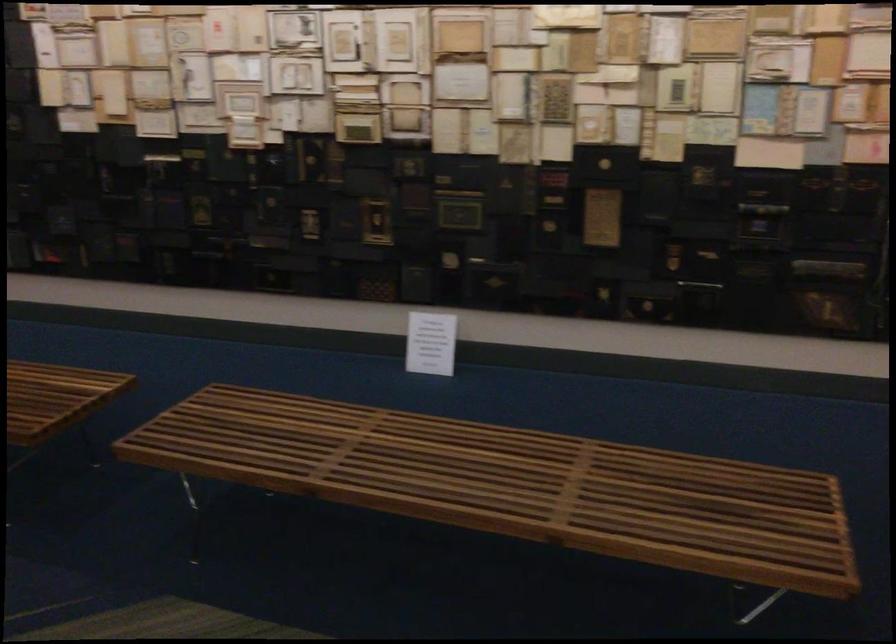
Image resolution: width=896 pixels, height=644 pixels. In order to click on chair sitting surface in this screenshot , I will do `click(501, 475)`.